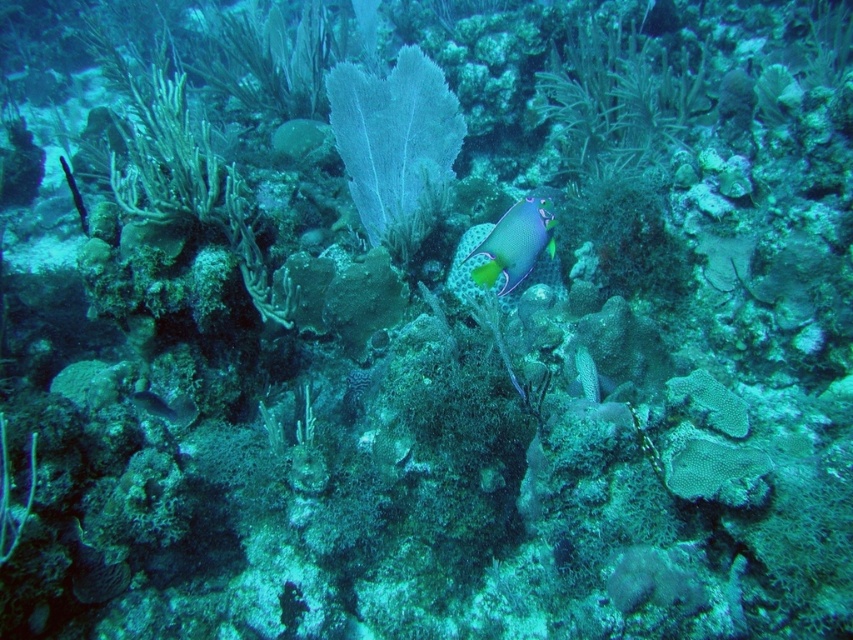
Question: Observing the image, what is the correct spatial positioning of translucent white coral at center in reference to shiny silver fish at lower left?

Choices:
 (A) above
 (B) below

Answer: (A)

Question: Does multicolored coral at center appear on the right side of shiny silver fish at lower left?

Choices:
 (A) no
 (B) yes

Answer: (B)

Question: Which of the following is the closest to the observer?

Choices:
 (A) pyautogui.click(x=335, y=96)
 (B) pyautogui.click(x=148, y=401)
 (C) pyautogui.click(x=540, y=246)

Answer: (C)

Question: Does multicolored coral at center lie in front of shiny silver fish at lower left?

Choices:
 (A) no
 (B) yes

Answer: (B)

Question: Among these objects, which one is nearest to the camera?

Choices:
 (A) multicolored coral at center
 (B) translucent white coral at center

Answer: (A)

Question: Which of these objects is positioned farthest from the shiny silver fish at lower left?

Choices:
 (A) multicolored coral at center
 (B) translucent white coral at center

Answer: (B)